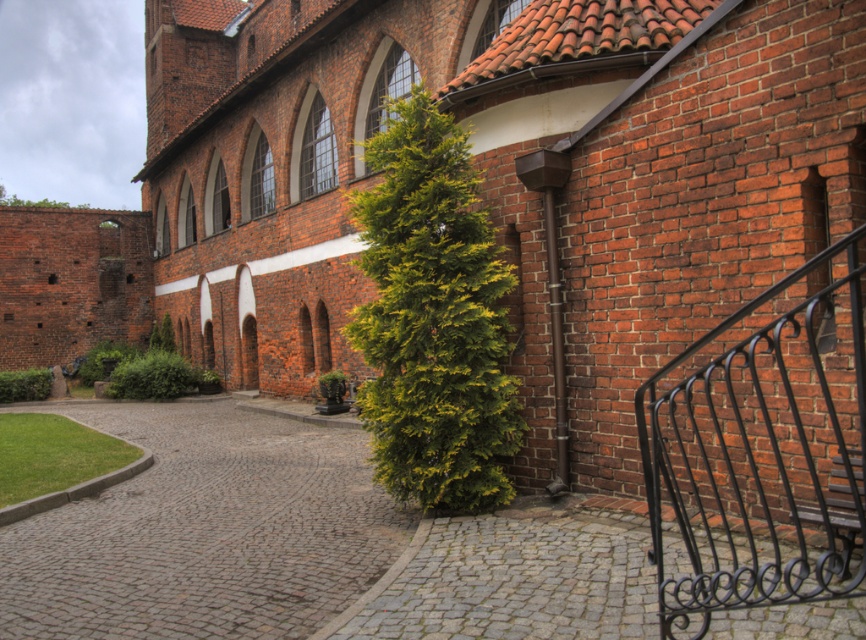
Is brown cobblestone path at center bigger than black wrought iron balustrade at right?

Yes, brown cobblestone path at center is bigger than black wrought iron balustrade at right.

Who is shorter, brown cobblestone path at center or black wrought iron balustrade at right?

brown cobblestone path at center is shorter.

Describe the element at coordinates (205, 531) in the screenshot. I see `brown cobblestone path at center` at that location.

Identify the location of brown cobblestone path at center. The height and width of the screenshot is (640, 866). (205, 531).

Between point (813, 330) and point (448, 634), which one is positioned behind?

The point (813, 330) is behind.

Can you confirm if black wrought iron balustrade at right is positioned above gray cobblestone path at lower center?

Yes, black wrought iron balustrade at right is above gray cobblestone path at lower center.

Is point (688, 531) positioned after point (414, 628)?

That is False.

This screenshot has height=640, width=866. I want to click on black wrought iron balustrade at right, so click(761, 451).

Between brown cobblestone path at center and gray cobblestone path at lower center, which one is positioned lower?

brown cobblestone path at center

Identify the location of brown cobblestone path at center. (205, 531).